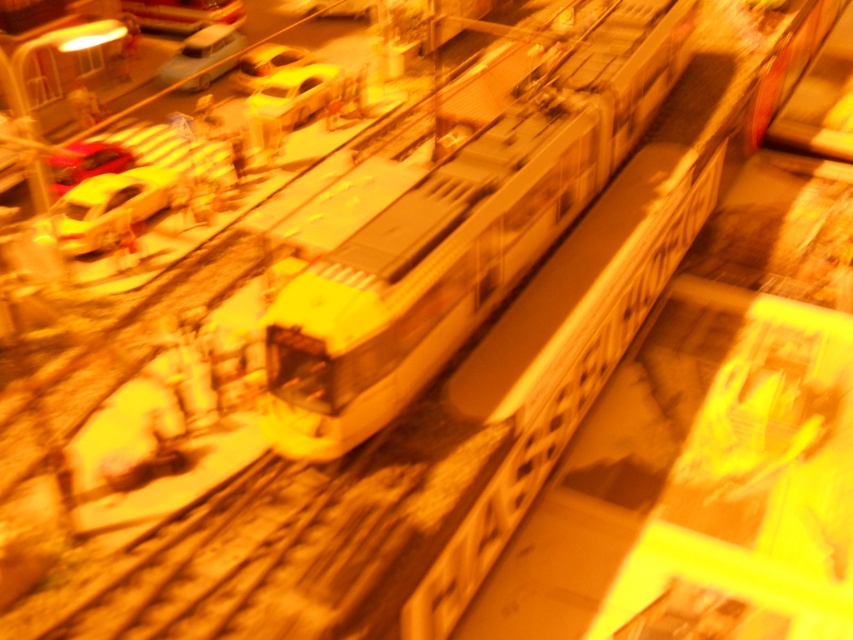
Question: Observing the image, what is the correct spatial positioning of matte plastic car at upper left in reference to metallic red car at left?

Choices:
 (A) right
 (B) left

Answer: (A)

Question: Which point is closer to the camera?

Choices:
 (A) (248, 60)
 (B) (48, 163)

Answer: (B)

Question: Which point is closer to the camera taking this photo?

Choices:
 (A) (399, 344)
 (B) (253, 60)
 (C) (234, 35)
 (D) (114, 161)

Answer: (A)

Question: Can you confirm if white glossy train at center is bigger than metallic red car at left?

Choices:
 (A) no
 (B) yes

Answer: (B)

Question: Which object appears farthest from the camera in this image?

Choices:
 (A) metallic red car at left
 (B) matte plastic car at upper left
 (C) yellow matte car at left
 (D) shiny yellow car at upper center

Answer: (B)

Question: Does metallic red car at left lie behind shiny yellow car at upper center?

Choices:
 (A) no
 (B) yes

Answer: (A)